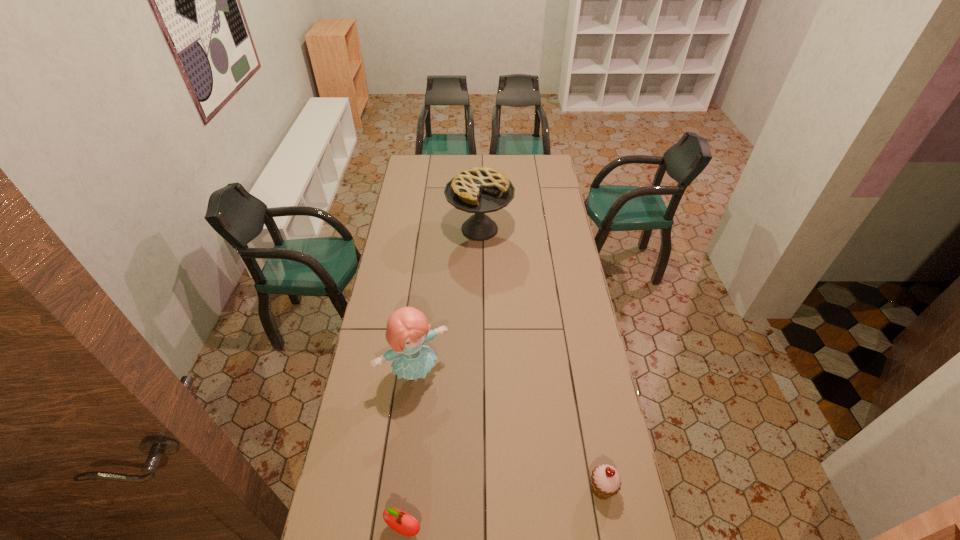
At what (x,y) coordinates should I click in order to perform the action: click on the second nearest object. Please return your answer as a coordinate pair (x, y). Image resolution: width=960 pixels, height=540 pixels. Looking at the image, I should click on (605, 480).

The width and height of the screenshot is (960, 540). Identify the location of the rightmost object. (605, 480).

I want to click on pie, so click(x=479, y=190).

Locate an element on the screen. The height and width of the screenshot is (540, 960). the third nearest object is located at coordinates (407, 330).

Image resolution: width=960 pixels, height=540 pixels. Identify the location of vacant space located 0.330m on the left of the cupcake. (482, 488).

Locate an element on the screen. This screenshot has height=540, width=960. vacant area located 0.390m on the cut side of the pie is located at coordinates (491, 311).

You are a GUI agent. You are given a task and a screenshot of the screen. Output one action in this format:
    pyautogui.click(x=<x>, y=<y>)
    Task: Click on the vacant space positioned 0.050m on the cut side of the pie
    The width and height of the screenshot is (960, 540).
    Given the screenshot: What is the action you would take?
    pyautogui.click(x=484, y=258)

Find the location of a particular element. The width and height of the screenshot is (960, 540). blank space located 0.340m on the cut side of the pie is located at coordinates (490, 302).

You are a GUI agent. You are given a task and a screenshot of the screen. Output one action in this format:
    pyautogui.click(x=<x>, y=<y>)
    Task: Click on the vacant space located on the front-facing side of the doll
    The image size is (960, 540).
    Given the screenshot: What is the action you would take?
    pyautogui.click(x=466, y=440)

At what (x,y) coordinates should I click in order to perform the action: click on vacant area situated 0.190m on the front-facing side of the doll. Please return your answer as a coordinate pair (x, y). The image size is (960, 540). Looking at the image, I should click on (459, 430).